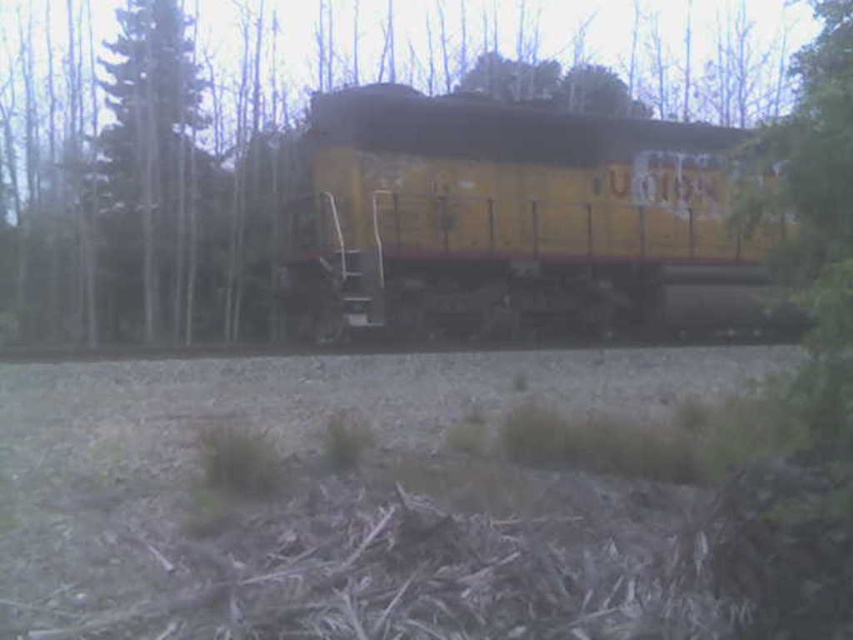
Consider the image. Can you confirm if green leafy tree at center is positioned to the left of yellow matte train at center?

No, green leafy tree at center is not to the left of yellow matte train at center.

Is point (1, 244) positioned before point (590, 150)?

No.

Is point (473, 177) farther from camera compared to point (619, 200)?

No, it is not.

This screenshot has width=853, height=640. Identify the location of green leafy tree at center. tap(369, 189).

Is point (235, 99) closer to viewer compared to point (112, 68)?

That is False.

Can you confirm if green leafy tree at center is wider than green textured tree at left?

Indeed, green leafy tree at center has a greater width compared to green textured tree at left.

Find the location of a particular element. green leafy tree at center is located at coordinates click(x=369, y=189).

What are the coordinates of `green leafy tree at center` in the screenshot? It's located at (369, 189).

Does yellow matte train at center have a greater height compared to green textured tree at left?

In fact, yellow matte train at center may be shorter than green textured tree at left.

This screenshot has height=640, width=853. I want to click on yellow matte train at center, so click(x=502, y=211).

Locate an element on the screen. The width and height of the screenshot is (853, 640). yellow matte train at center is located at coordinates (502, 211).